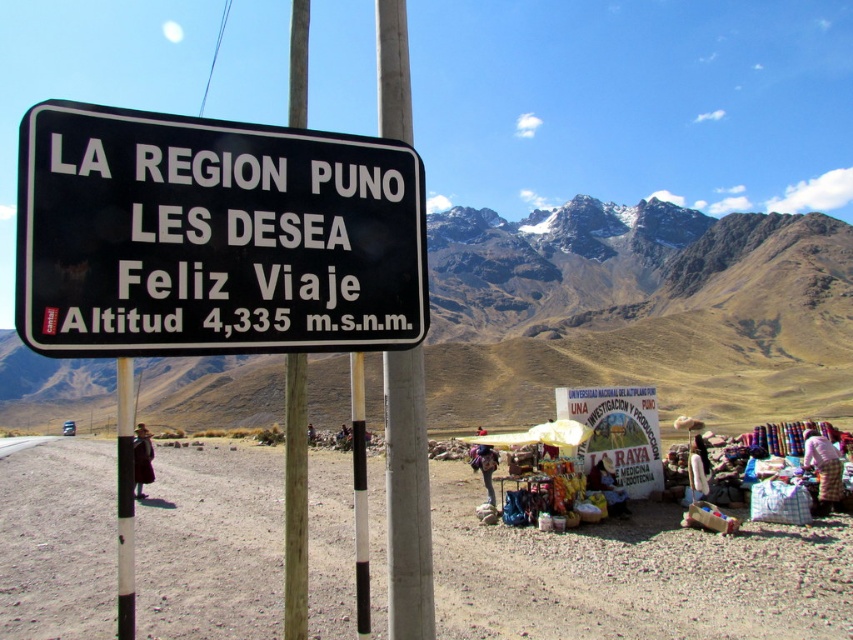
In the scene shown: You are a hiker planning to set up a tent in this mountainous area. You see the white painted metal pole at center and the dusty sand at lower right. Which location would be more suitable for setting up your tent?

The white painted metal pole at center is behind the dusty sand at lower right, so the dusty sand at lower right is closer to you. Since the dusty sand at lower right is in the foreground, it would be a more suitable location for setting up your tent as it is flatter and more accessible compared to the area behind the pole.

You are a hiker planning to take a photo of the black plastic sign at center and the white painted metal pole at center. Which object should you focus on first if you want both to be in sharp focus?

The black plastic sign at center is located above the white painted metal pole at center. Since they are stacked vertically, you can focus on the middle point between them to ensure both are in sharp focus.

You are standing at the roadside in the mountainous region of Puno, Peru, looking at the black rectangular sign. There are two points marked on the sign. One is at coordinate point (204, 477) and the other at point (419, 570). Which point is closer to your eyes?

Point (204, 477) is further to the camera than point (419, 570), so the point closer to your eyes is point (419, 570).